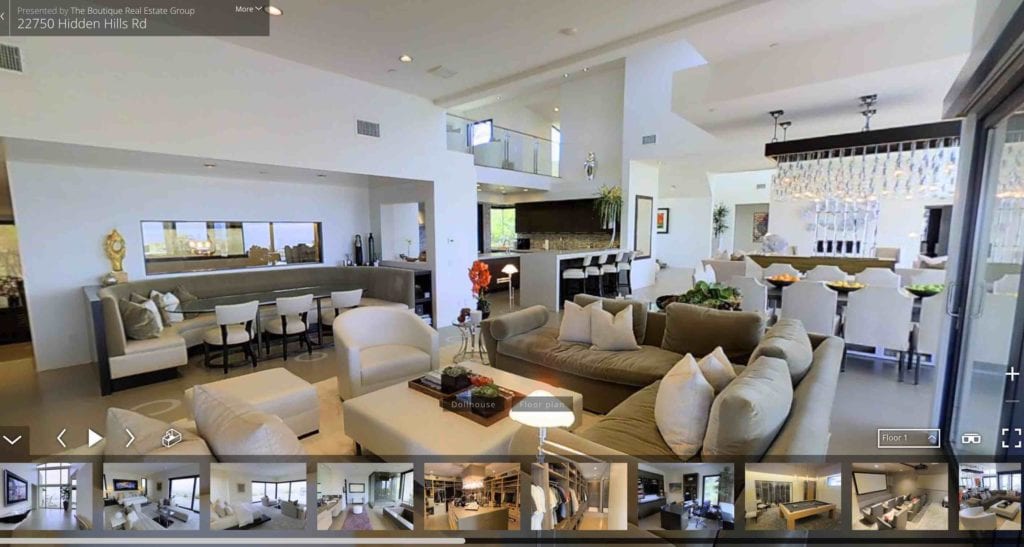
The height and width of the screenshot is (547, 1024). In order to click on floor in this screenshot , I will do `click(43, 411)`.